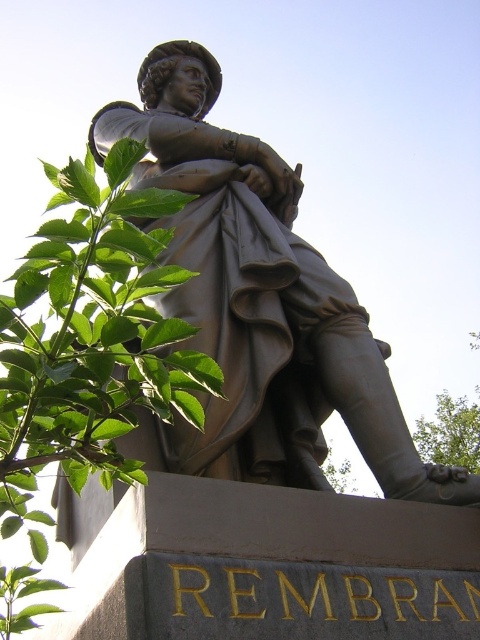
Is green leafy plant at upper left to the left of green leafy plant at lower right from the viewer's perspective?

Correct, you'll find green leafy plant at upper left to the left of green leafy plant at lower right.

Does green leafy plant at upper left lie behind green leafy plant at lower right?

No.

Locate an element on the screen. The width and height of the screenshot is (480, 640). green leafy plant at upper left is located at coordinates (90, 340).

Does bronze statue at center appear on the right side of green leafy plant at lower right?

In fact, bronze statue at center is to the left of green leafy plant at lower right.

Does bronze statue at center have a smaller size compared to green leafy plant at lower right?

Actually, bronze statue at center might be larger than green leafy plant at lower right.

Does point (184, 305) come behind point (452, 433)?

No, (184, 305) is closer to viewer.

Find the location of a particular element. bronze statue at center is located at coordinates (259, 296).

Is bronze statue at center wider than green leafy plant at upper left?

Correct, the width of bronze statue at center exceeds that of green leafy plant at upper left.

Does point (239, 378) come farther from viewer compared to point (61, 435)?

Yes, it is behind point (61, 435).

This screenshot has width=480, height=640. I want to click on bronze statue at center, so pos(259,296).